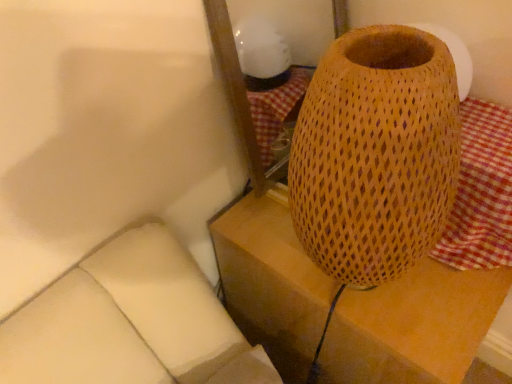
Locate an element on the screen. free spot above red checkered fabric at right (from a real-world perspective) is located at coordinates (487, 139).